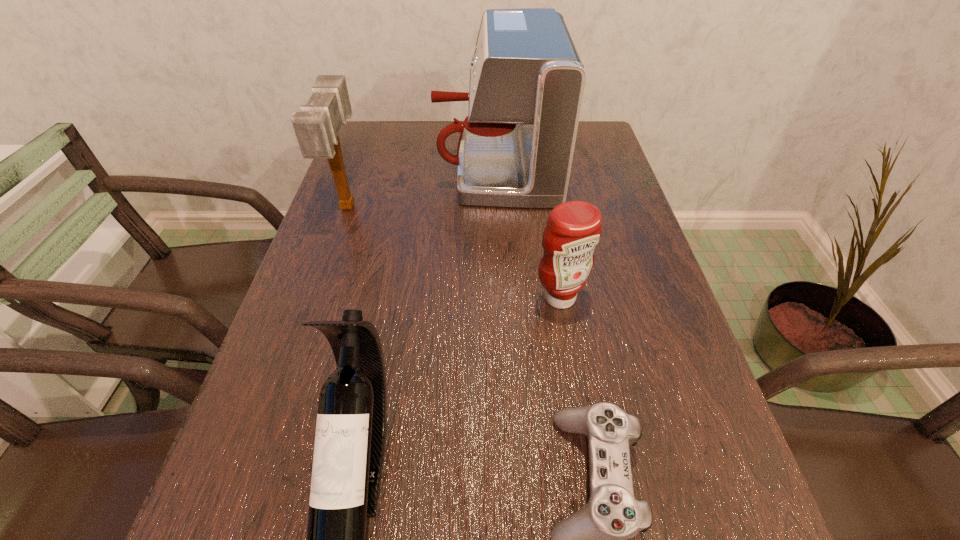
Where is `object situated at the left edge`? The height and width of the screenshot is (540, 960). object situated at the left edge is located at coordinates (316, 127).

The width and height of the screenshot is (960, 540). I want to click on vacant space at the far edge of the desktop, so click(419, 140).

The width and height of the screenshot is (960, 540). Identify the location of free space at the left edge of the desktop. (336, 194).

Image resolution: width=960 pixels, height=540 pixels. Identify the location of blank area at the right edge. (645, 341).

This screenshot has height=540, width=960. I want to click on vacant area that lies between the mallet and the coffee maker, so click(421, 187).

The height and width of the screenshot is (540, 960). Identify the location of vacant space that's between the mallet and the condiment. (454, 252).

Where is `blank region between the leftmost object and the third farthest object`? This screenshot has width=960, height=540. blank region between the leftmost object and the third farthest object is located at coordinates (454, 252).

At what (x,y) coordinates should I click in order to perform the action: click on vacant region between the tallest object and the third farthest object. Please return your answer as a coordinate pair (x, y). This screenshot has width=960, height=540. Looking at the image, I should click on (528, 233).

Locate an element on the screen. This screenshot has width=960, height=540. vacant area between the leftmost object and the coffee maker is located at coordinates (421, 187).

Find the location of `object that stands as the fourth closest to the third farthest object`. object that stands as the fourth closest to the third farthest object is located at coordinates (316, 127).